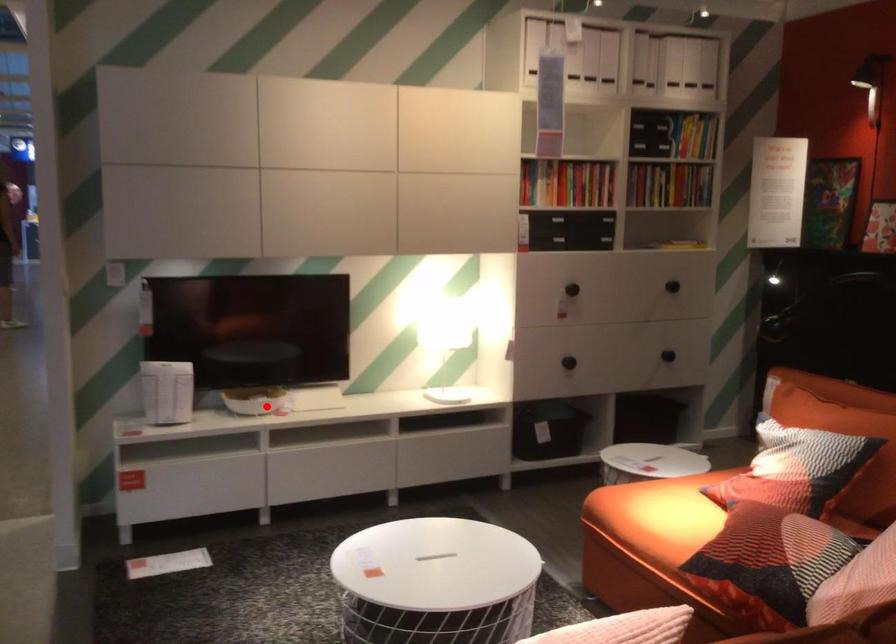
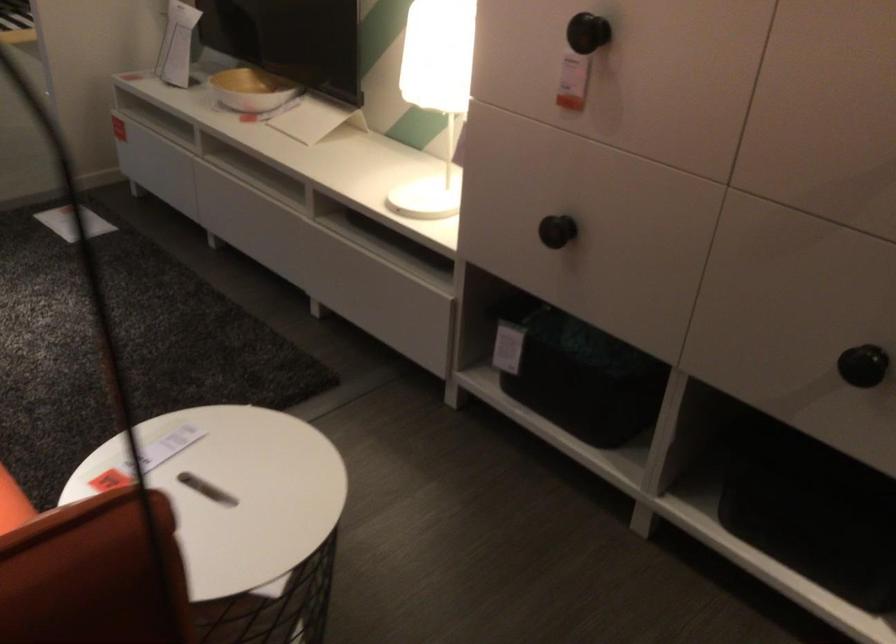
Question: I am providing you with two images of the same scene from different viewpoints. A red point is shown in image1. For the corresponding object point in image2, is it positioned nearer or farther from the camera?

Choices:
 (A) Nearer
 (B) Farther

Answer: (A)